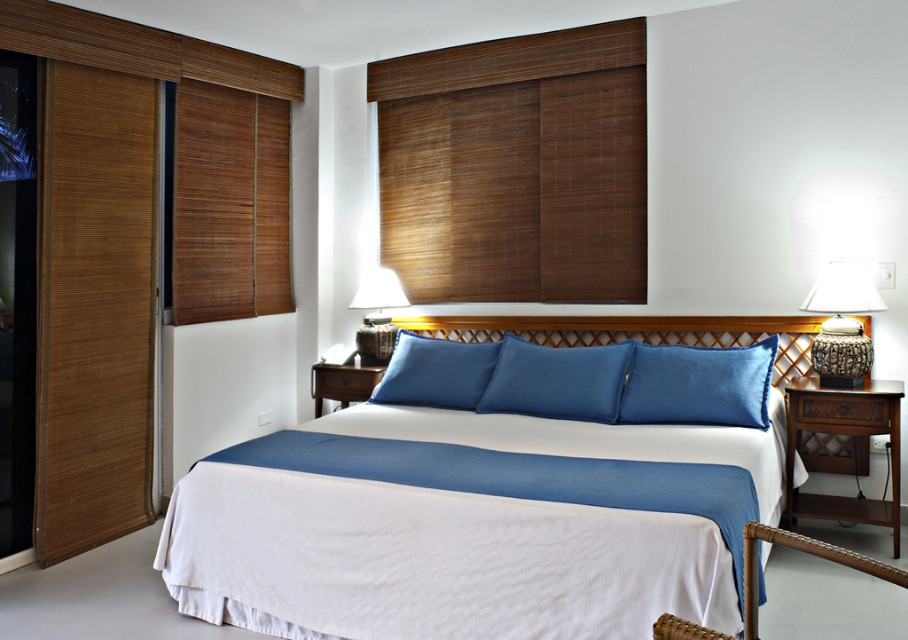
Is blue suede pillow at center wider than blue matte pillow at center?

Correct, the width of blue suede pillow at center exceeds that of blue matte pillow at center.

Which of these two, blue suede pillow at center or blue matte pillow at center, stands taller?

With more height is blue suede pillow at center.

This screenshot has width=908, height=640. I want to click on blue suede pillow at center, so click(x=698, y=385).

Is point (492, 189) farther from camera compared to point (757, 413)?

Yes, point (492, 189) is farther from viewer.

Is point (492, 275) more distant than point (692, 365)?

Yes.

This screenshot has width=908, height=640. In order to click on brown woven blinds at upper center in this screenshot , I will do `click(516, 168)`.

Who is positioned more to the right, brown wood nightstand at right or blue matte pillow at center?

brown wood nightstand at right

Who is more distant from viewer, (x=856, y=410) or (x=403, y=381)?

The point (x=403, y=381) is more distant.

Identify the location of brown wood nightstand at right. (844, 435).